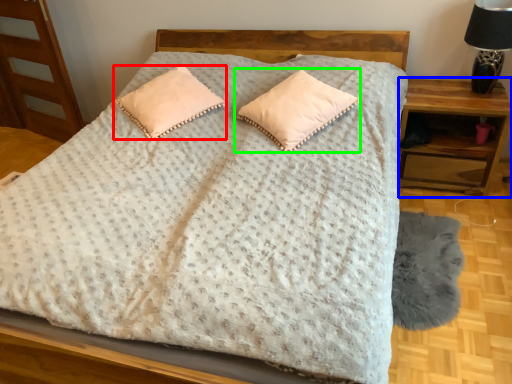
Question: Based on their relative distances, which object is farther from pillow (highlighted by a red box)? Choose from nightstand (highlighted by a blue box) and pillow (highlighted by a green box).

Choices:
 (A) nightstand
 (B) pillow

Answer: (A)